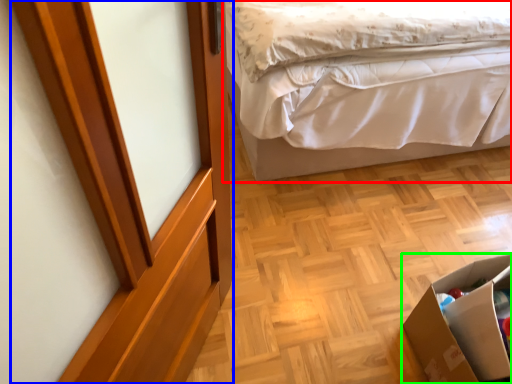
Question: Which object is positioned farthest from bed (highlighted by a red box)? Select from screen door (highlighted by a blue box) and cardboard box (highlighted by a green box).

Choices:
 (A) screen door
 (B) cardboard box

Answer: (A)